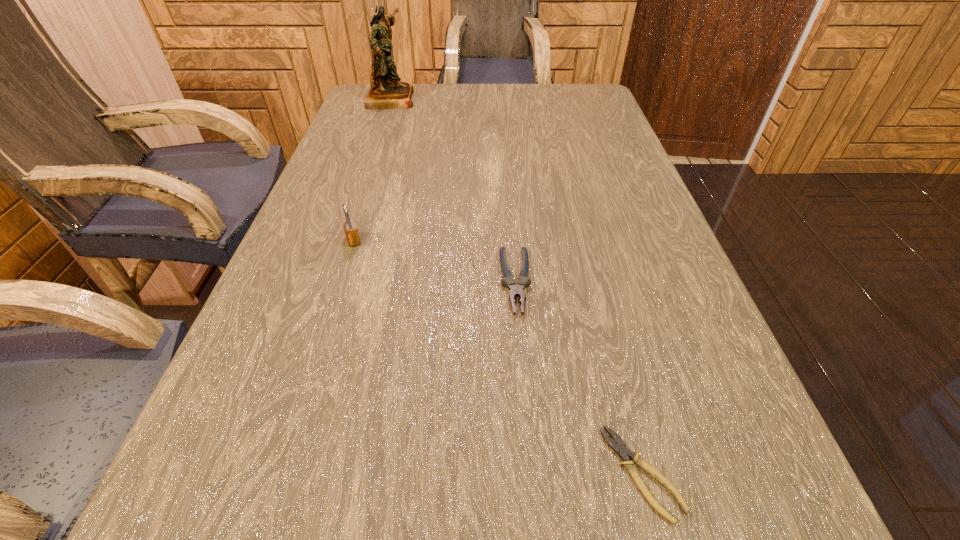
What are the coordinates of `vacant region that satisfies the following two spatial constraints: 1. on the front-facing side of the padlock; 2. on the right side of the tallest object` in the screenshot? It's located at (343, 240).

Find the location of a particular element. The width and height of the screenshot is (960, 540). vacant space that satisfies the following two spatial constraints: 1. at the gripping part of the nearer pliers; 2. on the right side of the third farthest object is located at coordinates (531, 473).

At what (x,y) coordinates should I click in order to perform the action: click on vacant space that satisfies the following two spatial constraints: 1. at the gripping part of the rightmost object; 2. on the left side of the third tallest object. Please return your answer as a coordinate pair (x, y). This screenshot has height=540, width=960. Looking at the image, I should click on (531, 473).

Locate an element on the screen. The height and width of the screenshot is (540, 960). free space that satisfies the following two spatial constraints: 1. at the gripping part of the shortest object; 2. on the left side of the second object from right to left is located at coordinates tap(531, 473).

At what (x,y) coordinates should I click in order to perform the action: click on free space that satisfies the following two spatial constraints: 1. on the front-facing side of the farthest object; 2. on the right side of the third shortest object. Please return your answer as a coordinate pair (x, y). This screenshot has height=540, width=960. Looking at the image, I should click on [x=343, y=240].

Locate an element on the screen. The height and width of the screenshot is (540, 960). vacant point that satisfies the following two spatial constraints: 1. on the front-facing side of the third shortest object; 2. on the right side of the farthest object is located at coordinates (343, 240).